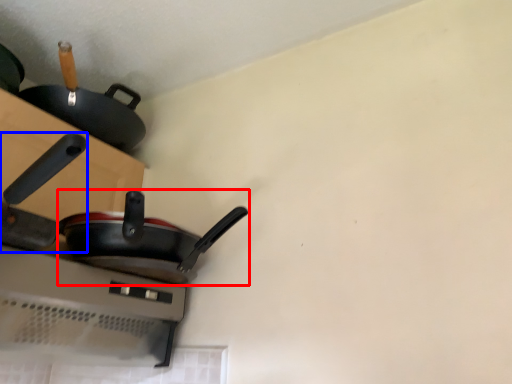
Question: Which object is closer to the camera taking this photo, frying pan (highlighted by a red box) or frying pan (highlighted by a blue box)?

Choices:
 (A) frying pan
 (B) frying pan

Answer: (B)